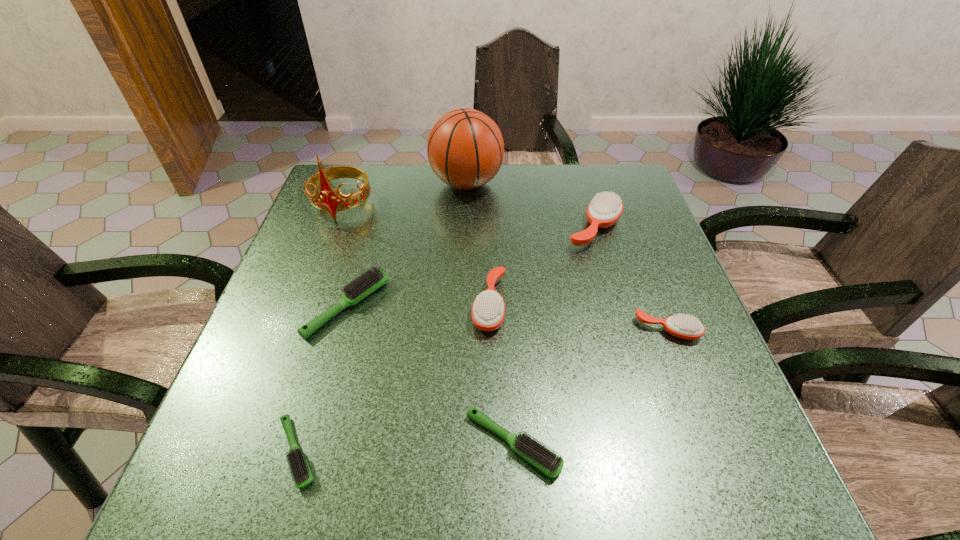
Where is `vacant area at the right edge`? vacant area at the right edge is located at coordinates (672, 343).

Identify the location of vacant space at the near right corner of the desktop. The image size is (960, 540). (733, 455).

Find the location of a particular element. This screenshot has height=540, width=960. free spot between the leftmost orange hairbrush and the farthest hairbrush is located at coordinates (542, 266).

At what (x,y) coordinates should I click in order to perform the action: click on blank region between the basketball and the smallest orange hairbrush. Please return your answer as a coordinate pair (x, y). The height and width of the screenshot is (540, 960). Looking at the image, I should click on (567, 256).

Identify the location of vacant point located between the second biggest light hairbrush and the tallest hairbrush. The height and width of the screenshot is (540, 960). (554, 336).

Locate an element on the screen. Image resolution: width=960 pixels, height=540 pixels. vacant area that lies between the seventh tallest object and the tiara is located at coordinates (427, 324).

You are a GUI agent. You are given a task and a screenshot of the screen. Output one action in this format:
    pyautogui.click(x=<x>, y=<y>)
    Task: Click on the vacant area between the second biggest light hairbrush and the farthest light hairbrush
    The width and height of the screenshot is (960, 540).
    Given the screenshot: What is the action you would take?
    pyautogui.click(x=430, y=375)

At what (x,y) coordinates should I click in order to perform the action: click on vacant area between the smallest light hairbrush and the tiara. Please return your answer as a coordinate pair (x, y). The width and height of the screenshot is (960, 540). Looking at the image, I should click on (320, 328).

At what (x,y) coordinates should I click in order to perform the action: click on vacant area that lies between the fifth tallest hairbrush and the biggest light hairbrush. Please return your answer as a coordinate pair (x, y). The width and height of the screenshot is (960, 540). Looking at the image, I should click on tap(430, 375).

Find the location of `free space between the third tallest object and the farthest light hairbrush`. free space between the third tallest object and the farthest light hairbrush is located at coordinates (470, 267).